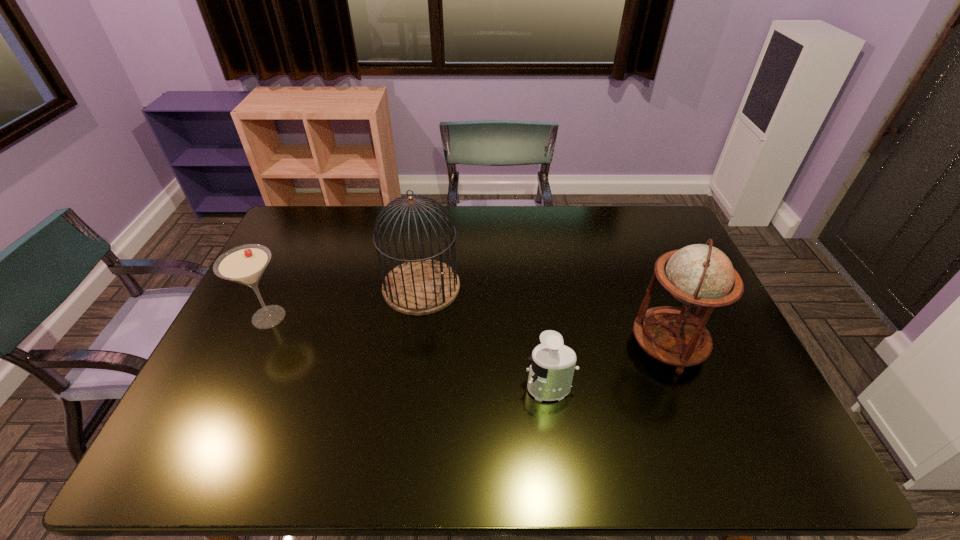
Where is `the second object from left to right`? the second object from left to right is located at coordinates (417, 287).

I want to click on the rightmost object, so click(700, 275).

At what (x,y) coordinates should I click in order to perform the action: click on the leftmost object. Please return your answer as a coordinate pair (x, y). This screenshot has width=960, height=540. Looking at the image, I should click on (245, 264).

Locate an element on the screen. Image resolution: width=960 pixels, height=540 pixels. the shortest object is located at coordinates (552, 367).

At what (x,y) coordinates should I click in order to perform the action: click on juicer. Please return your answer as a coordinate pair (x, y). This screenshot has height=540, width=960. Looking at the image, I should click on (552, 367).

Where is `free region located at the door of the second object from left to right`? The image size is (960, 540). free region located at the door of the second object from left to right is located at coordinates (520, 287).

You are a GUI agent. You are given a task and a screenshot of the screen. Output one action in this format:
    pyautogui.click(x=<x>, y=<y>)
    Task: Click on the free space located on the surface of the rightmost object
    The width and height of the screenshot is (960, 540).
    Given the screenshot: What is the action you would take?
    pyautogui.click(x=530, y=345)

This screenshot has height=540, width=960. What are the coordinates of `vacant position located 0.340m on the surface of the rightmost object` in the screenshot? It's located at click(508, 345).

At what (x,y) coordinates should I click in order to perform the action: click on free location located 0.300m on the surface of the rightmost object. Please return your answer as a coordinate pair (x, y). The height and width of the screenshot is (540, 960). Looking at the image, I should click on (522, 345).

Identify the location of free space located on the back of the leftmost object. The image size is (960, 540). (288, 275).